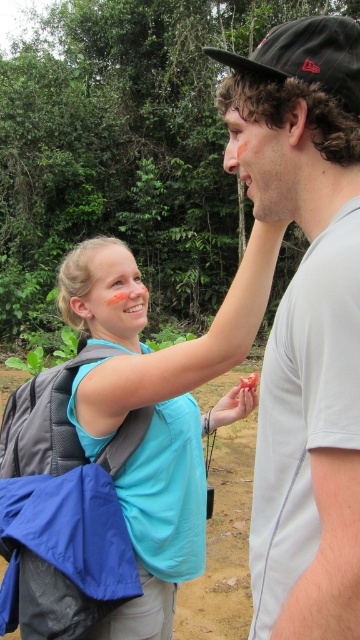
Does gray cotton t-shirt at center have a greater width compared to gray fabric backpack at upper left?

In fact, gray cotton t-shirt at center might be narrower than gray fabric backpack at upper left.

Describe the element at coordinates (304, 323) in the screenshot. I see `gray cotton t-shirt at center` at that location.

In order to click on gray cotton t-shirt at center in this screenshot , I will do `click(304, 323)`.

Between point (318, 388) and point (159, 566), which one is positioned behind?

The point (159, 566) is behind.

Is point (318, 577) positioned behind point (204, 420)?

No, (318, 577) is in front of (204, 420).

Locate an element on the screen. The height and width of the screenshot is (640, 360). gray cotton t-shirt at center is located at coordinates (304, 323).

Where is `blue fabric backpack at left`? This screenshot has height=640, width=360. blue fabric backpack at left is located at coordinates (168, 508).

Is blue fabric backpack at left below gray fabric backpack at upper left?

No, blue fabric backpack at left is not below gray fabric backpack at upper left.

Who is more forward, (x=178, y=564) or (x=110, y=524)?

Point (x=110, y=524) is in front.

Find the location of `blue fabric backpack at left`. blue fabric backpack at left is located at coordinates (168, 508).